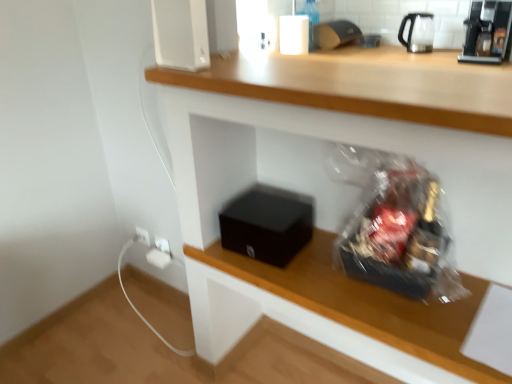
Question: Considering the positions of point click(x=501, y=13) and point click(x=419, y=18), is point click(x=501, y=13) closer or farther from the camera than point click(x=419, y=18)?

Choices:
 (A) farther
 (B) closer

Answer: (B)

Question: Considering the positions of black plastic coffee machine at upper right and transparent glass tea pot at upper right in the image, is black plastic coffee machine at upper right bigger or smaller than transparent glass tea pot at upper right?

Choices:
 (A) small
 (B) big

Answer: (B)

Question: Estimate the real-world distances between objects in this image. Which object is farther from the white plastic electric outlet at lower left?

Choices:
 (A) black plastic coffee machine at upper right
 (B) black matte box at center
 (C) clear glass bottle at upper center
 (D) black matte box at lower center
 (E) transparent glass tea pot at upper right

Answer: (E)

Question: Considering the real-world distances, which object is farthest from the black matte box at lower center?

Choices:
 (A) black matte box at center
 (B) transparent glass tea pot at upper right
 (C) white plastic electric outlet at lower left
 (D) black plastic coffee machine at upper right
 (E) clear glass bottle at upper center

Answer: (B)